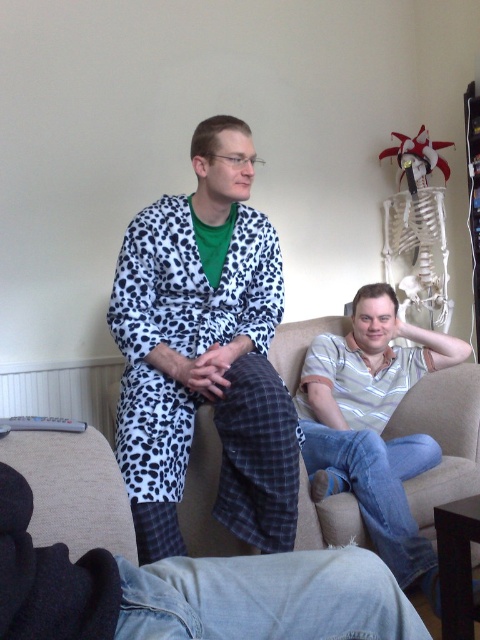
Question: Which of the following is the farthest from the observer?

Choices:
 (A) denim pants at lower center
 (B) striped cotton shirt at center
 (C) white leopard print robe at left

Answer: (C)

Question: Which of the following is the farthest from the observer?

Choices:
 (A) (187, 604)
 (B) (371, 515)
 (C) (264, 216)

Answer: (C)

Question: From the image, what is the correct spatial relationship of white leopard print robe at left in relation to striped cotton shirt at center?

Choices:
 (A) below
 (B) above

Answer: (B)

Question: Is white leopard print robe at left wider than striped cotton shirt at center?

Choices:
 (A) yes
 (B) no

Answer: (B)

Question: Which object is farther from the camera taking this photo?

Choices:
 (A) white leopard print robe at left
 (B) denim pants at lower center

Answer: (A)

Question: Can you confirm if denim pants at lower center is positioned above striped cotton shirt at center?

Choices:
 (A) no
 (B) yes

Answer: (A)